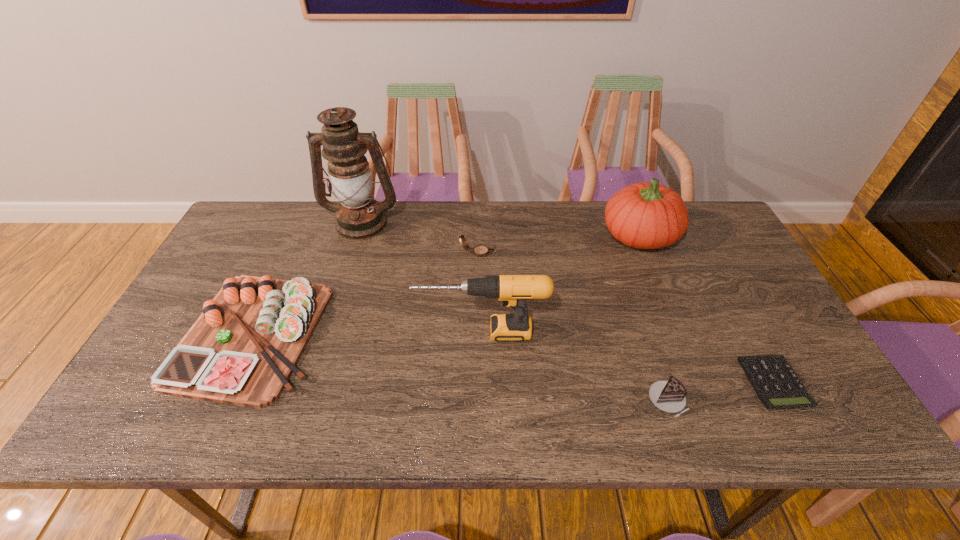
Find the location of a particular element. This screenshot has width=960, height=540. chocolate cake situated at the near edge is located at coordinates 669,396.

Locate an element on the screen. calculator at the near edge is located at coordinates (775, 382).

The height and width of the screenshot is (540, 960). What are the coordinates of `object that is at the left edge` in the screenshot? It's located at (242, 350).

Where is `pumpkin that is at the right edge`? This screenshot has width=960, height=540. pumpkin that is at the right edge is located at coordinates (647, 215).

Identify the location of calculator located at the right edge. This screenshot has width=960, height=540. (x=775, y=382).

Find the location of a particular element. The width and height of the screenshot is (960, 540). object that is at the near left corner is located at coordinates (242, 350).

What are the coordinates of `object that is at the far right corner` in the screenshot? It's located at (647, 215).

Locate an element on the screen. The image size is (960, 540). object that is at the near right corner is located at coordinates (775, 382).

The image size is (960, 540). Identify the location of free space at the far edge of the desktop. (469, 246).

The width and height of the screenshot is (960, 540). Identify the location of vacant point at the right edge. (792, 360).